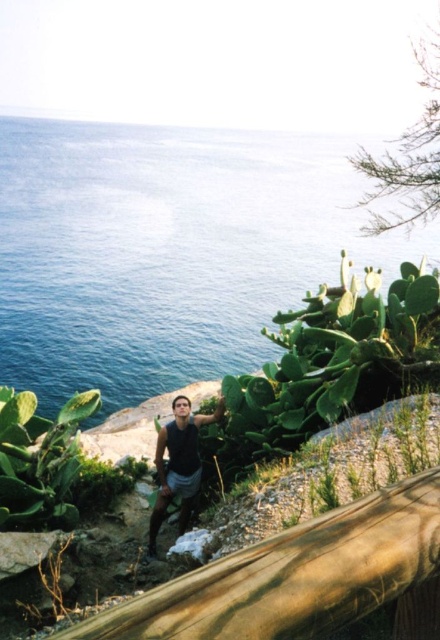
Does blue water at upper left lie in front of matte black tank top at center?

No, blue water at upper left is behind matte black tank top at center.

Which is below, blue water at upper left or matte black tank top at center?

Positioned lower is matte black tank top at center.

Between point (314, 260) and point (175, 424), which one is positioned behind?

The point (314, 260) is more distant.

Identify the location of blue water at upper left. Image resolution: width=440 pixels, height=640 pixels. (167, 250).